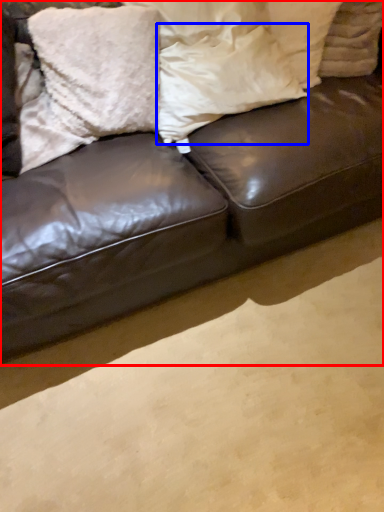
Question: Which of the following is the farthest to the observer, studio couch (highlighted by a red box) or pillow (highlighted by a blue box)?

Choices:
 (A) studio couch
 (B) pillow

Answer: (B)